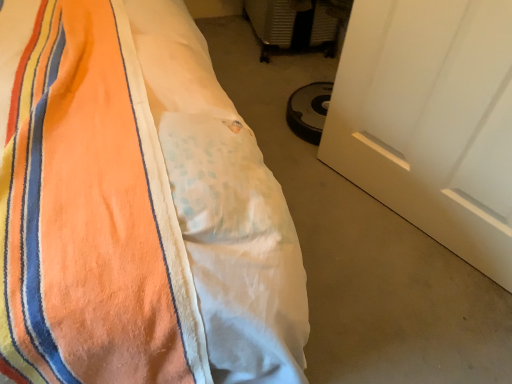
Question: Does white fabric at lower left appear on the right side of white matte door at lower right?

Choices:
 (A) yes
 (B) no

Answer: (B)

Question: Could white matte door at lower right be considered to be inside white fabric at lower left?

Choices:
 (A) yes
 (B) no

Answer: (B)

Question: Can you confirm if white fabric at lower left is shorter than white matte door at lower right?

Choices:
 (A) yes
 (B) no

Answer: (A)

Question: From a real-world perspective, is white fabric at lower left positioned under white matte door at lower right based on gravity?

Choices:
 (A) yes
 (B) no

Answer: (A)

Question: Is white fabric at lower left positioned with its back to white matte door at lower right?

Choices:
 (A) no
 (B) yes

Answer: (A)

Question: Considering the relative positions of white fabric at lower left and white matte door at lower right in the image provided, is white fabric at lower left in front of white matte door at lower right?

Choices:
 (A) no
 (B) yes

Answer: (A)

Question: Does white fabric at lower left have a lesser width compared to orange fleece blanket at left?

Choices:
 (A) yes
 (B) no

Answer: (A)

Question: From the image's perspective, is white fabric at lower left on top of orange fleece blanket at left?

Choices:
 (A) yes
 (B) no

Answer: (B)

Question: From the image's perspective, is white fabric at lower left below orange fleece blanket at left?

Choices:
 (A) yes
 (B) no

Answer: (A)

Question: Is white fabric at lower left shorter than orange fleece blanket at left?

Choices:
 (A) yes
 (B) no

Answer: (A)

Question: Is white fabric at lower left to the left of orange fleece blanket at left from the viewer's perspective?

Choices:
 (A) no
 (B) yes

Answer: (A)

Question: Is white fabric at lower left outside of orange fleece blanket at left?

Choices:
 (A) no
 (B) yes

Answer: (B)

Question: Can you confirm if orange fleece blanket at left is bigger than white matte door at lower right?

Choices:
 (A) yes
 (B) no

Answer: (A)